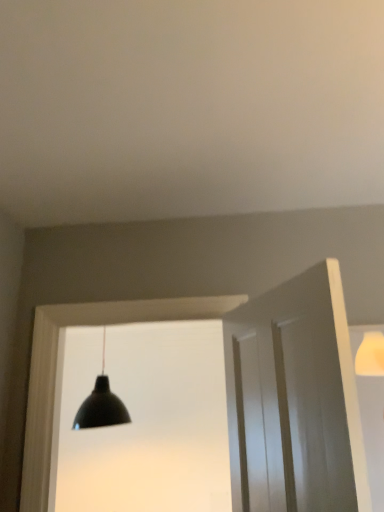
Question: From the image's perspective, is white smooth door at right located above or below white wood door frame at center?

Choices:
 (A) below
 (B) above

Answer: (B)

Question: In terms of height, does white smooth door at right look taller or shorter compared to white wood door frame at center?

Choices:
 (A) tall
 (B) short

Answer: (B)

Question: Which of these objects is positioned farthest from the black matte lamp at center?

Choices:
 (A) white smooth door at right
 (B) white wood door frame at center

Answer: (A)

Question: Which object is the farthest from the white wood door frame at center?

Choices:
 (A) white smooth door at right
 (B) black matte lamp at center

Answer: (B)